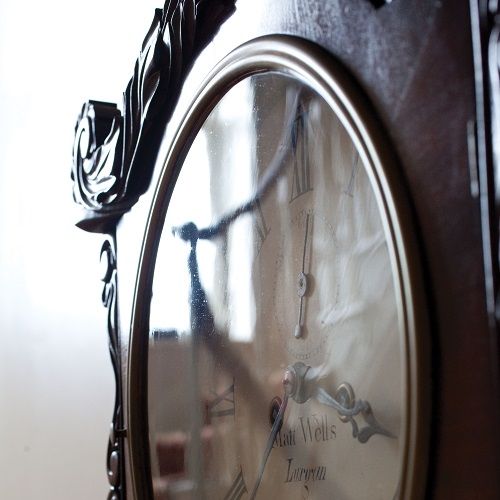
At what (x,y) coordinates should I click in order to perform the action: click on clock. Please return your answer as a coordinate pair (x, y). The width and height of the screenshot is (500, 500). Looking at the image, I should click on (323, 336).